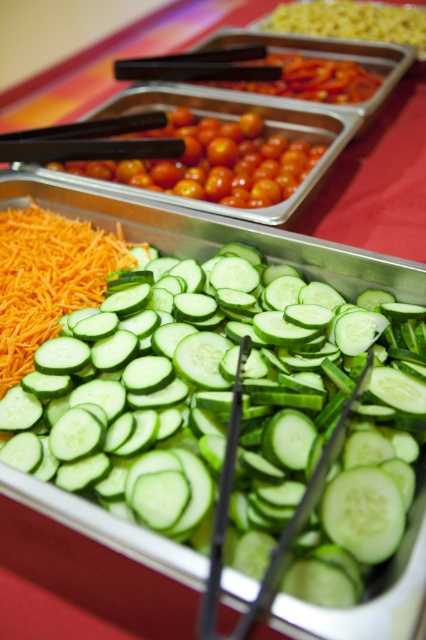
Does green smooth cucumber at center have a greater height compared to glossy cherry tomatoes at center?

Indeed, green smooth cucumber at center has a greater height compared to glossy cherry tomatoes at center.

Which of these two, green smooth cucumber at center or glossy cherry tomatoes at center, stands taller?

green smooth cucumber at center

Between point (172, 396) and point (218, 172), which one is positioned behind?

Point (218, 172)

Find the location of a particular element. green smooth cucumber at center is located at coordinates (227, 413).